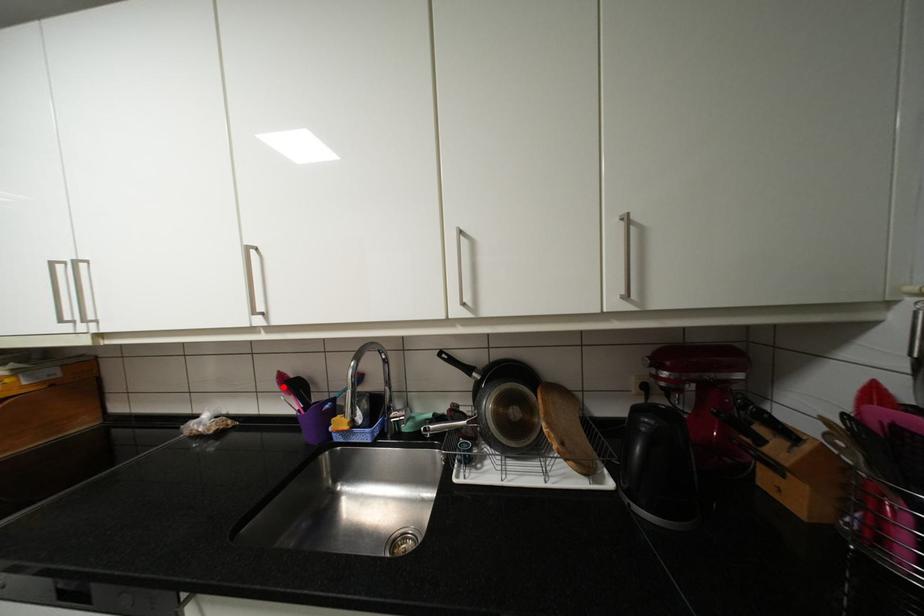
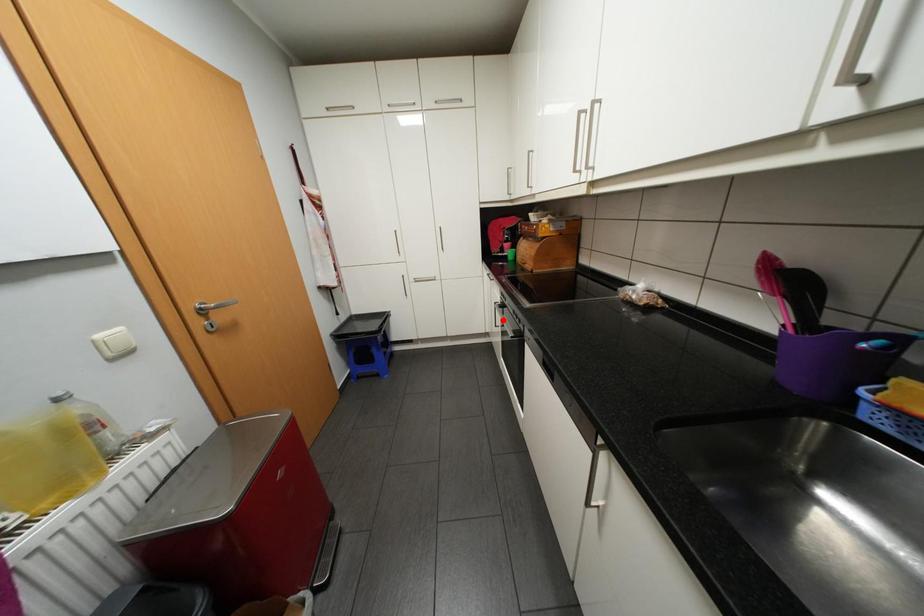
I am providing you with two images of the same scene from different viewpoints. A red point is marked on the first image and another point is marked on the second image. Do the highlighted points in image1 and image2 indicate the same real-world spot?

No